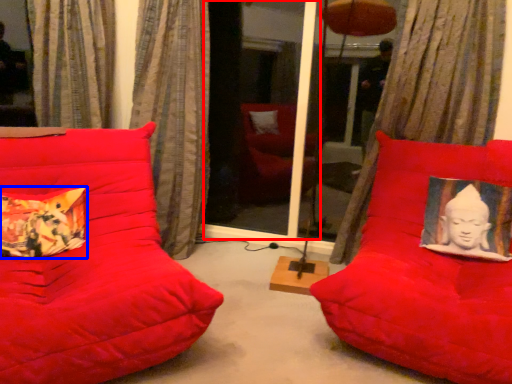
Question: Which object appears closest to the camera in this image, screen door (highlighted by a red box) or pillow (highlighted by a blue box)?

Choices:
 (A) screen door
 (B) pillow

Answer: (B)